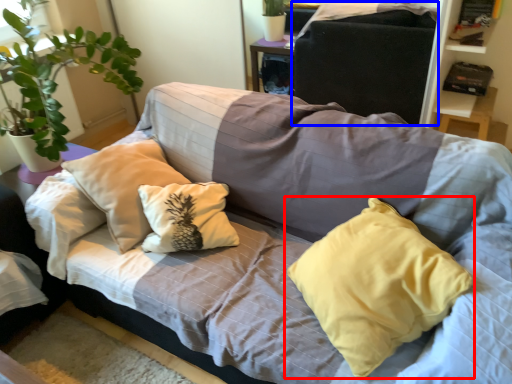
Question: Among these objects, which one is farthest to the camera, pillow (highlighted by a red box) or gray (highlighted by a blue box)?

Choices:
 (A) pillow
 (B) gray

Answer: (B)